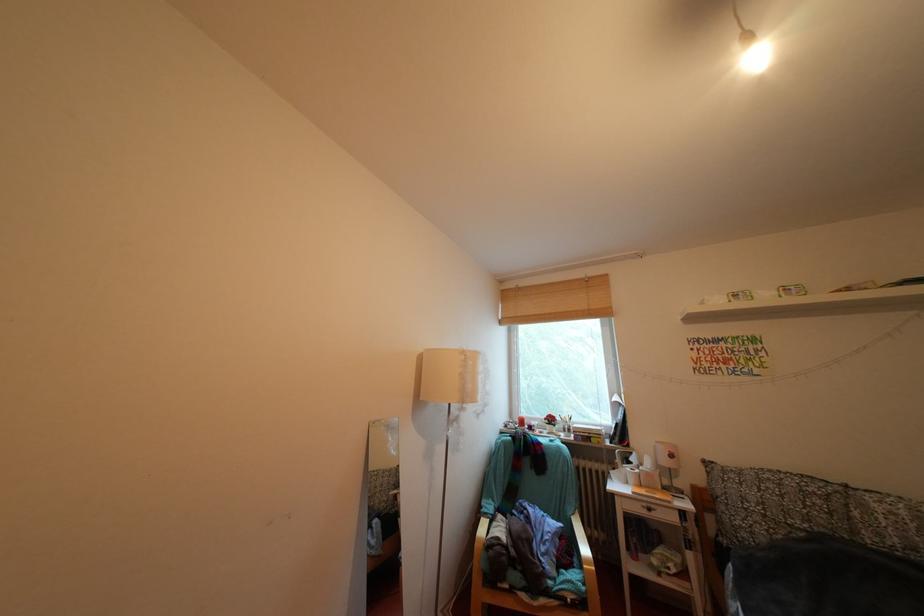
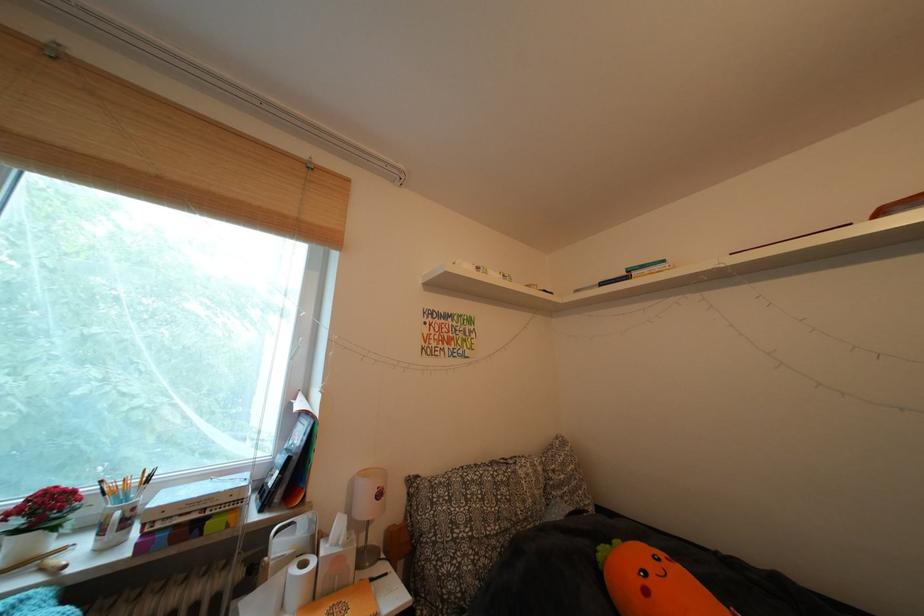
Where in the second image is the point corresponding to point (561, 424) from the first image?

(56, 513)